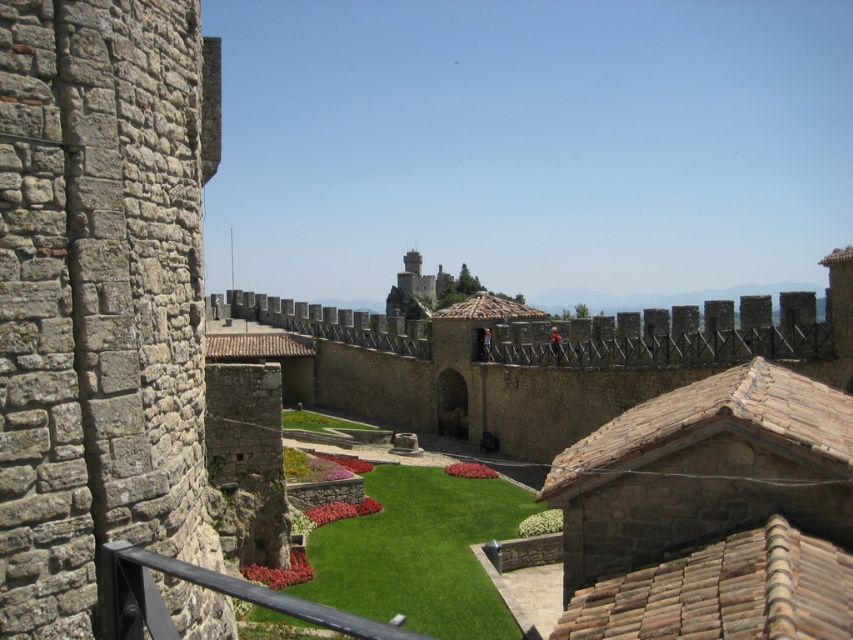
You are standing at the entrance of the medieval castle complex and want to walk towards the green artificial turf at center. According to the coordinates provided, in which direction should you head from your current position?

You should head towards the coordinates point at (419, 552) to reach the green artificial turf at center.

You are a groundskeeper at the medieval castle complex. You need to determine which area at the center of the image is more suitable for placing a decorative stone statue that requires a stable, flat surface. Based on the scene description, which area would you recommend between the green artificial turf at center and the green grass at center?

The green artificial turf at center is shorter than the green grass at center, so the green artificial turf at center would provide a more stable and flat surface for placing the decorative stone statue.

Looking at this image, you are standing on the castle wall and looking down at the lawn. You see both the green artificial turf at center and the green grass at center. Which one is positioned to the right side?

The green artificial turf at center is positioned to the right of the green grass at center.